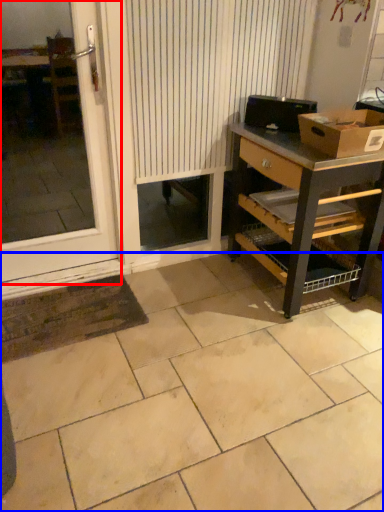
Question: Which point is closer to the camera, window (highlighted by a red box) or ceramic tile (highlighted by a blue box)?

Choices:
 (A) window
 (B) ceramic tile

Answer: (B)